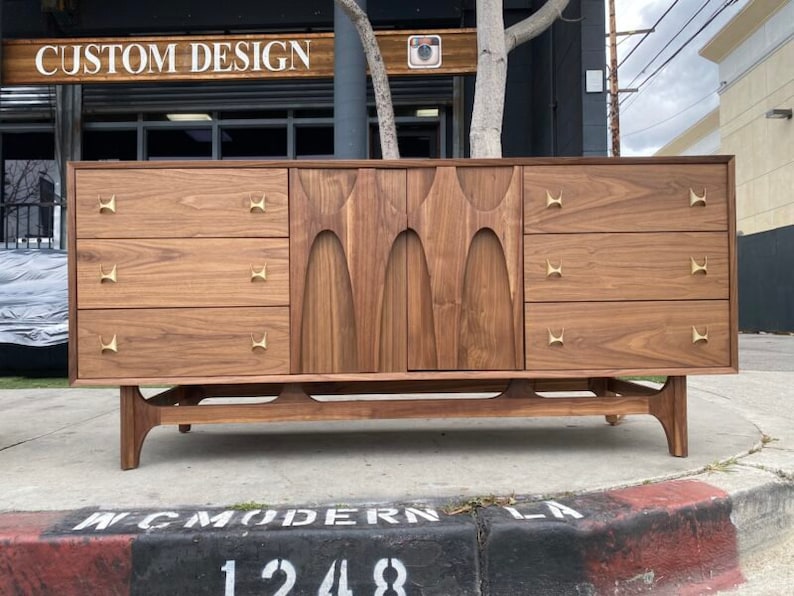
Where is `window`? window is located at coordinates 40,176.